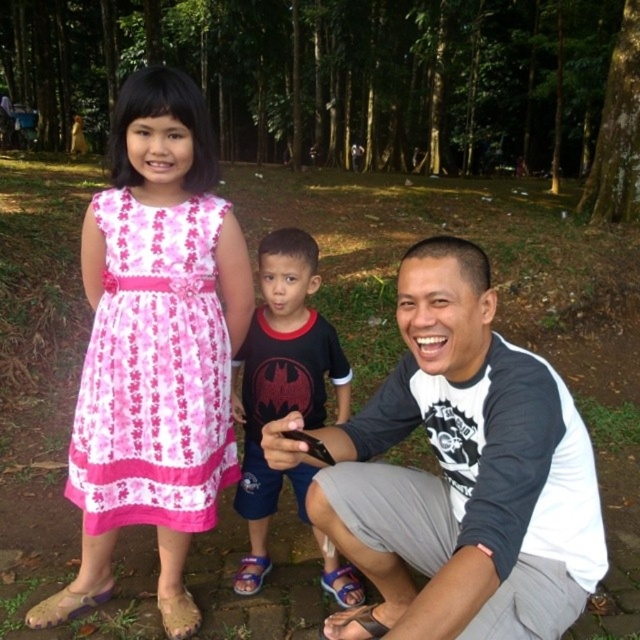
Question: Which point is farther to the camera?

Choices:
 (A) (253, 504)
 (B) (84, 468)

Answer: (A)

Question: Observing the image, what is the correct spatial positioning of pink floral dress at left in reference to dark blue fabric shirt at center?

Choices:
 (A) below
 (B) above

Answer: (B)

Question: Can you confirm if gray/white raglan shirt at lower center is positioned to the left of dark blue fabric shirt at center?

Choices:
 (A) no
 (B) yes

Answer: (A)

Question: Does pink floral dress at left have a larger size compared to pink fabric dress at left?

Choices:
 (A) no
 (B) yes

Answer: (B)

Question: Which of the following is the farthest from the observer?

Choices:
 (A) gray/white raglan shirt at lower center
 (B) pink floral dress at left
 (C) pink fabric dress at left

Answer: (C)

Question: Estimate the real-world distances between objects in this image. Which object is closer to the pink floral dress at left?

Choices:
 (A) pink fabric dress at left
 (B) gray/white raglan shirt at lower center

Answer: (A)